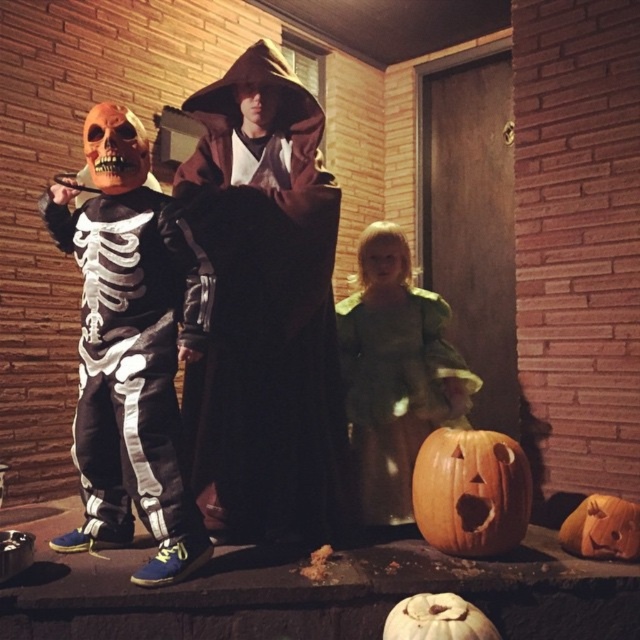
Does white matte skeleton costume at left have a lesser height compared to orange carved pumpkin at center?

No.

What are the coordinates of `white matte skeleton costume at left` in the screenshot? It's located at (131, 348).

You are a GUI agent. You are given a task and a screenshot of the screen. Output one action in this format:
    pyautogui.click(x=<x>, y=<y>)
    Task: Click on the white matte skeleton costume at left
    The image size is (640, 640).
    Given the screenshot: What is the action you would take?
    pyautogui.click(x=131, y=348)

Can you confirm if white matte skeleton costume at left is taller than carved wood pumpkin at lower center?

Yes, white matte skeleton costume at left is taller than carved wood pumpkin at lower center.

Is point (196, 269) farther from camera compared to point (432, 531)?

That is False.

Identify the location of white matte skeleton costume at left. This screenshot has width=640, height=640. (131, 348).

Between brown velvet robe at center and orange matte pumpkin at lower center, which one appears on the left side from the viewer's perspective?

Positioned to the left is brown velvet robe at center.

Based on the photo, does brown velvet robe at center have a smaller size compared to orange matte pumpkin at lower center?

No.

Find the location of a particular element. The width and height of the screenshot is (640, 640). brown velvet robe at center is located at coordinates (264, 307).